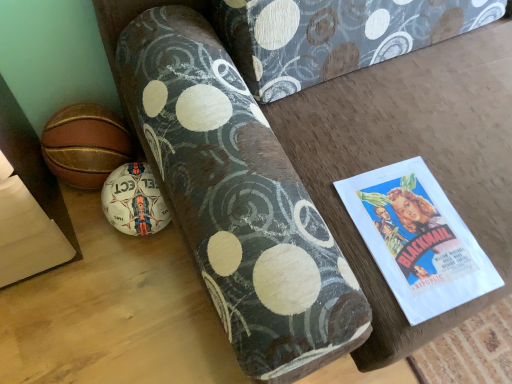
The width and height of the screenshot is (512, 384). I want to click on vacant space situated above leather basketball at lower left, placed as the first ball when sorted from top to bottom (from a real-world perspective), so click(82, 127).